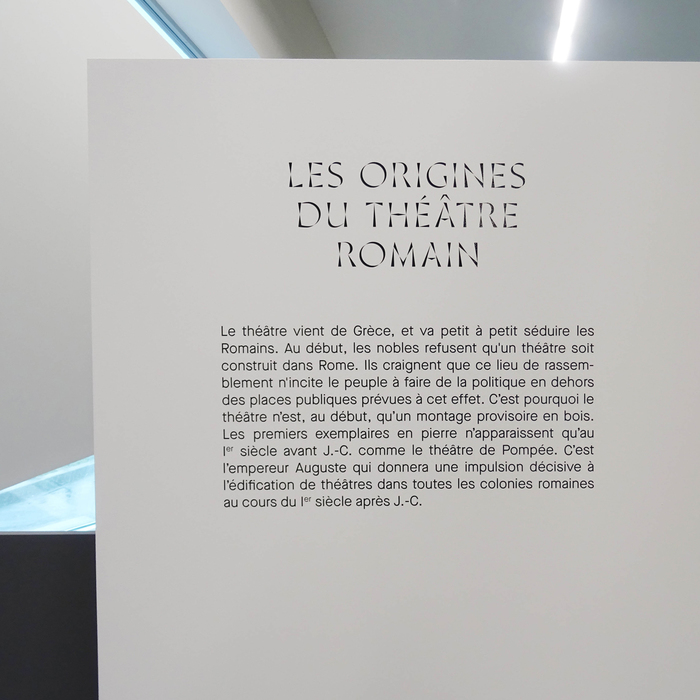
Identify the location of light. (570, 29).